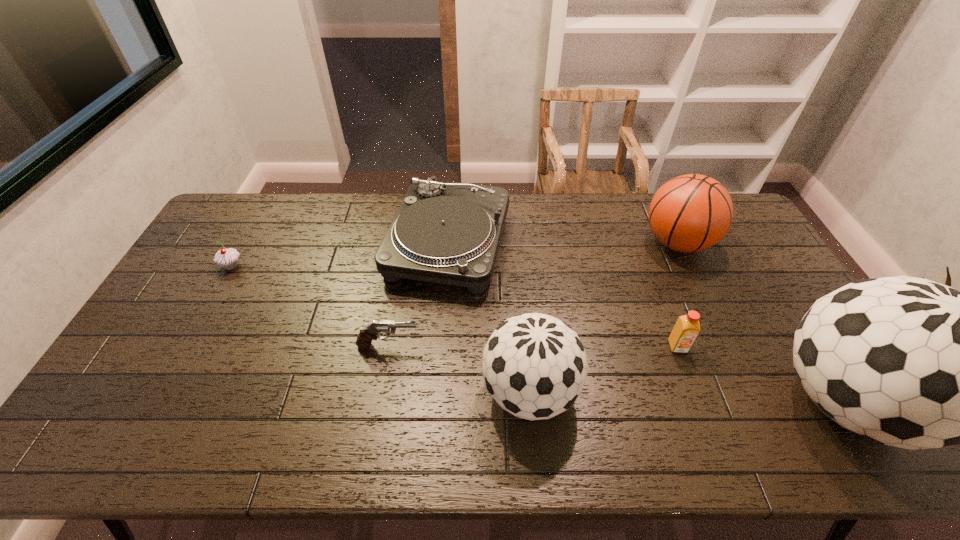
Where is `the left soccer ball`? the left soccer ball is located at coordinates (534, 365).

Find the location of `basketball`. basketball is located at coordinates (690, 213).

Locate an element on the screen. Image resolution: width=960 pixels, height=540 pixels. record player is located at coordinates (444, 232).

Locate an element on the screen. cupcake is located at coordinates (227, 258).

At what (x,y) coordinates should I click in order to perform the action: click on orange juice. Please return your answer as a coordinate pair (x, y). Looking at the image, I should click on (687, 327).

Identify the location of pistol. (368, 333).

I want to click on free space located 0.090m on the right of the shorter soccer ball, so click(613, 393).

Identify the location of vacant region located 0.110m on the left of the basketball. (609, 243).

Identify the location of vacant space situated 0.120m on the right of the record player. This screenshot has height=540, width=960. (545, 245).

The image size is (960, 540). Identify the location of vacant space located on the front of the cupcake. (212, 300).